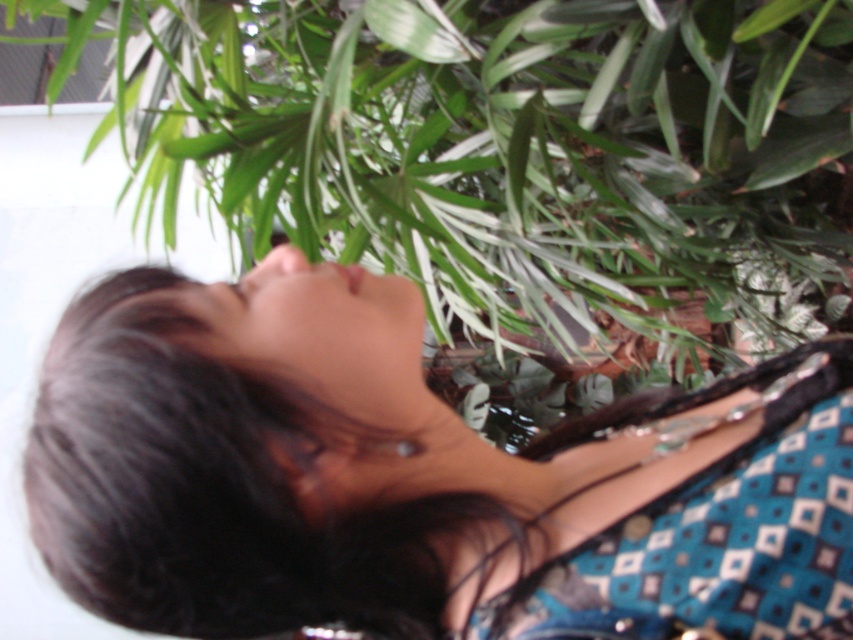
Question: Which point is closer to the camera taking this photo?

Choices:
 (A) (115, 572)
 (B) (575, 147)

Answer: (A)

Question: Which of the following is the closest to the observer?

Choices:
 (A) (212, 113)
 (B) (85, 378)

Answer: (B)

Question: Is blue printed dress at center wider than green leafy plant at upper center?

Choices:
 (A) no
 (B) yes

Answer: (A)

Question: Does blue printed dress at center have a larger size compared to green leafy plant at upper center?

Choices:
 (A) yes
 (B) no

Answer: (B)

Question: Is blue printed dress at center below green leafy plant at upper center?

Choices:
 (A) no
 (B) yes

Answer: (B)

Question: Which point appears closest to the camera in this image?

Choices:
 (A) 691,193
 (B) 529,474

Answer: (B)